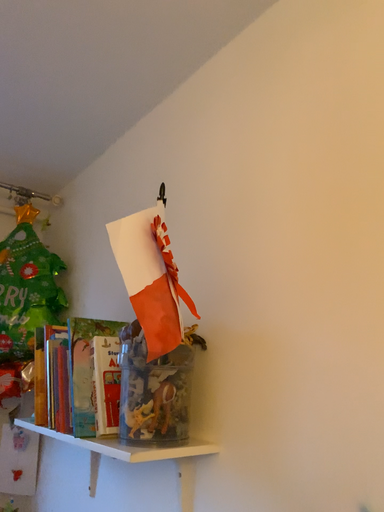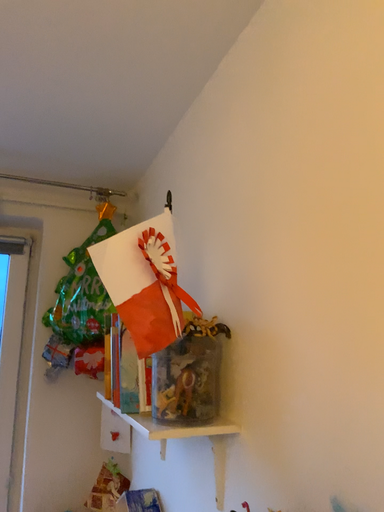
Question: Which way did the camera rotate in the video?

Choices:
 (A) rotated left
 (B) rotated right

Answer: (A)